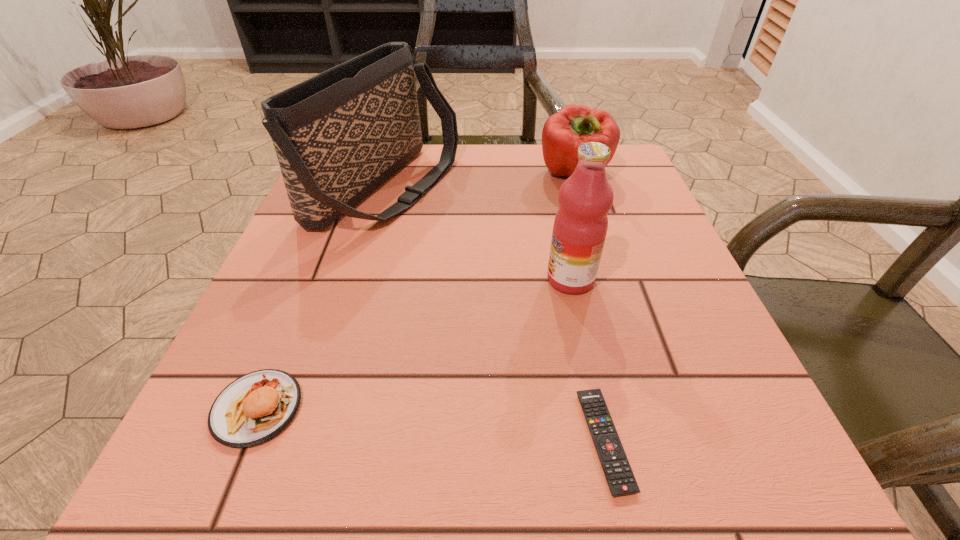
The width and height of the screenshot is (960, 540). What are the coordinates of `empty space between the third nearest object and the handbag` in the screenshot? It's located at (478, 234).

Identify the location of empty space between the remote control and the third shortest object. Image resolution: width=960 pixels, height=540 pixels. (589, 308).

The height and width of the screenshot is (540, 960). I want to click on vacant region between the third shortest object and the remote control, so click(589, 308).

Where is `vacant space in between the third shortest object and the handbag`? This screenshot has height=540, width=960. vacant space in between the third shortest object and the handbag is located at coordinates (481, 181).

Find the location of a particular element. The height and width of the screenshot is (540, 960). empty space between the shortest object and the third tallest object is located at coordinates (589, 308).

What are the coordinates of `free space between the handbag and the second shortest object` in the screenshot? It's located at (322, 298).

Locate an element on the screen. This screenshot has width=960, height=540. free space that is in between the fruit juice and the handbag is located at coordinates (478, 234).

At what (x,y) coordinates should I click in order to perform the action: click on the third closest object relative to the handbag. Please return your answer as a coordinate pair (x, y). Looking at the image, I should click on (255, 407).

Select which object is the second closest to the remote control. Please provide its 2D coordinates. Your answer should be formatted as a tuple, i.e. [(x, y)], where the tuple contains the x and y coordinates of a point satisfying the conditions above.

[(338, 135)]

Where is `vacant space that satisfies the following two spatial constraints: 1. on the back side of the patty; 2. on the right side of the handbag`? vacant space that satisfies the following two spatial constraints: 1. on the back side of the patty; 2. on the right side of the handbag is located at coordinates (348, 188).